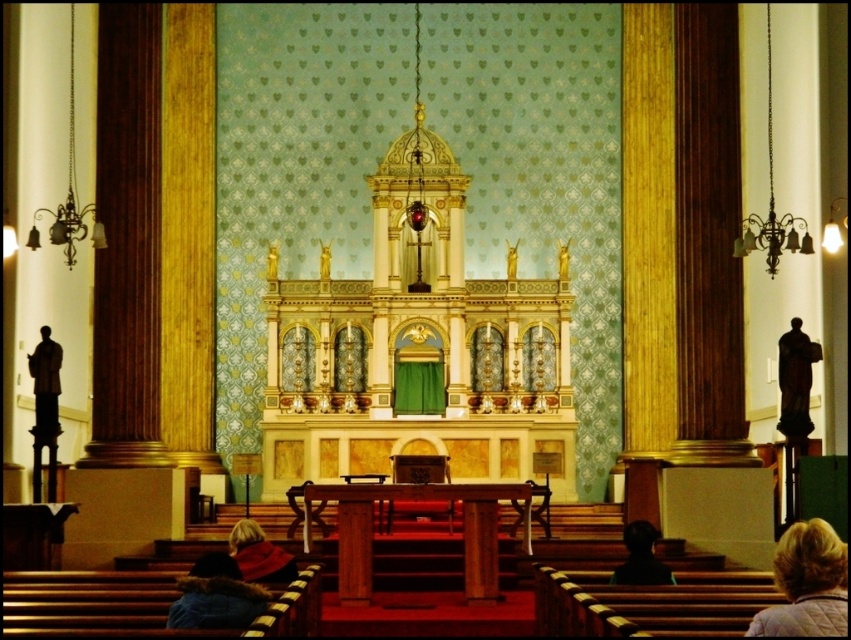
Question: Which point is closer to the camera?

Choices:
 (A) (629, 528)
 (B) (41, 369)
 (C) (800, 560)

Answer: (C)

Question: Is blonde hair at lower right above dark hair at lower center?

Choices:
 (A) no
 (B) yes

Answer: (B)

Question: Is blonde hair at lower right to the right of brown fur coat at lower left from the viewer's perspective?

Choices:
 (A) no
 (B) yes

Answer: (B)

Question: Which of the following is the closest to the observer?

Choices:
 (A) dark hair at lower center
 (B) silhouette wooden statue at left
 (C) blonde hair at lower right

Answer: (C)

Question: Which point is farther to the camera?

Choices:
 (A) blonde hair at lower right
 (B) silhouette wooden statue at left
 (C) brown fur coat at lower left
 (D) dark hair at lower center

Answer: (B)

Question: Does brown fur coat at lower left appear over silhouette wooden statue at left?

Choices:
 (A) yes
 (B) no

Answer: (B)